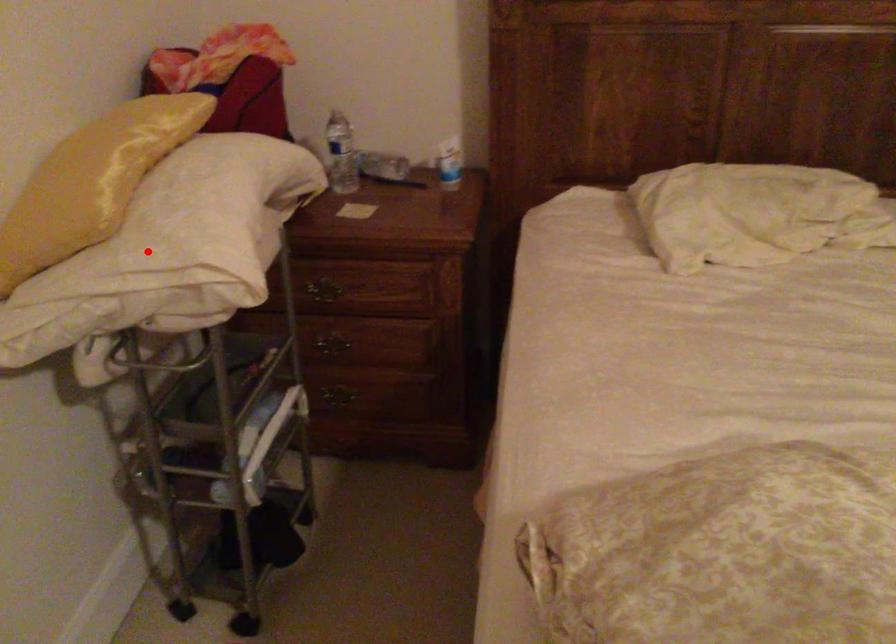
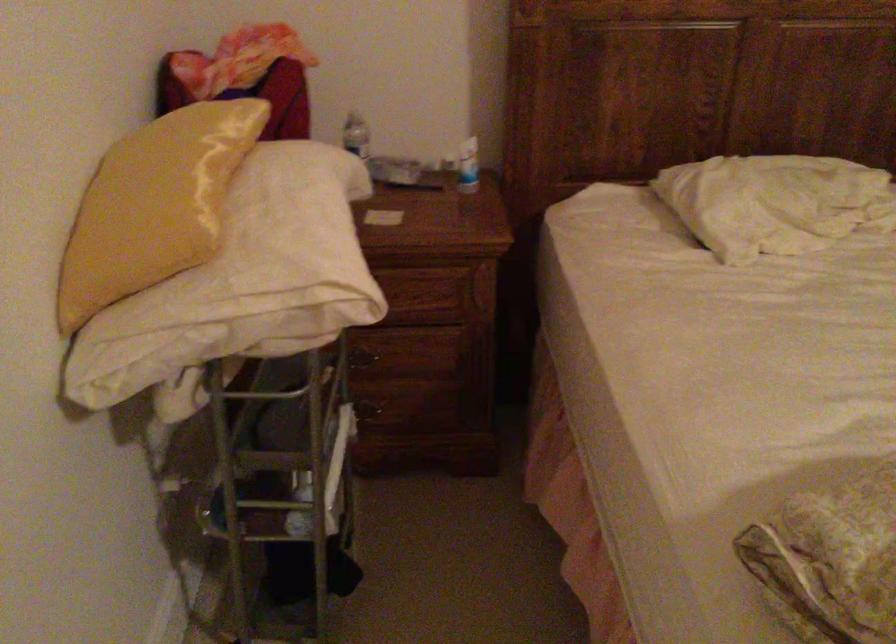
Where in the second image is the point corresponding to the highlighted location from the first image?

(254, 272)